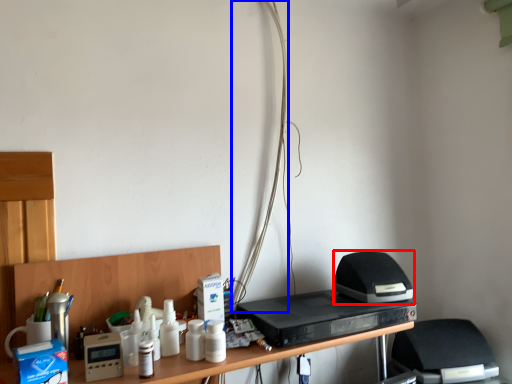
Question: Which of the following is the farthest to the observer, appliance (highlighted by a red box) or wire (highlighted by a blue box)?

Choices:
 (A) appliance
 (B) wire

Answer: (B)